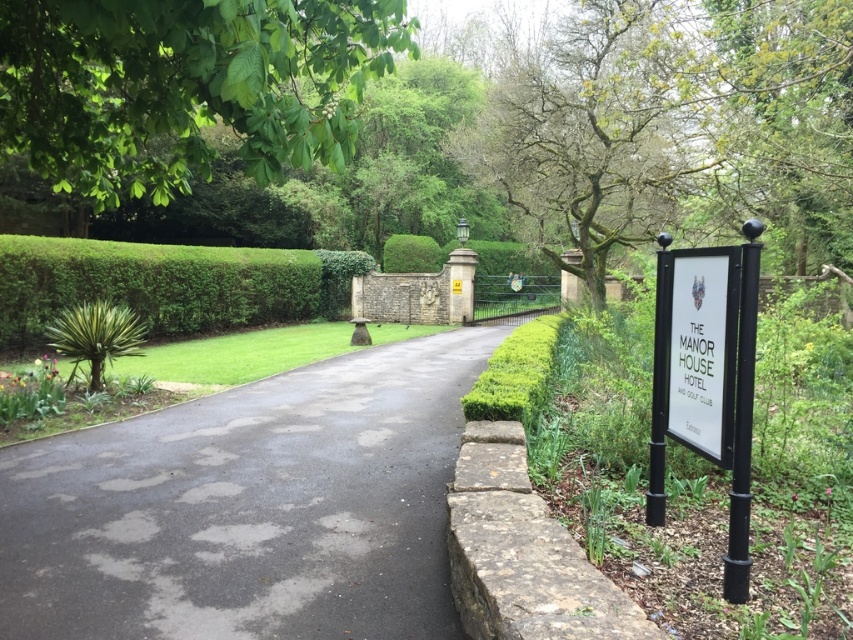
Looking at this image, you are a guest arriving at The Manor House Hotel and Golf Club. You notice a green leafy tree at upper left and a white paper sign at right. Which object is wider?

The green leafy tree at upper left might be wider than the white paper sign at right according to the description.

You are a guest arriving at The Manor House Hotel and Golf Club. You notice the dark gray asphalt at center and the green leafy tree at upper left. Which object is located to the right of the other?

The dark gray asphalt at center is positioned on the right side of green leafy tree at upper left, so the dark gray asphalt at center is to the right of the green leafy tree at upper left.